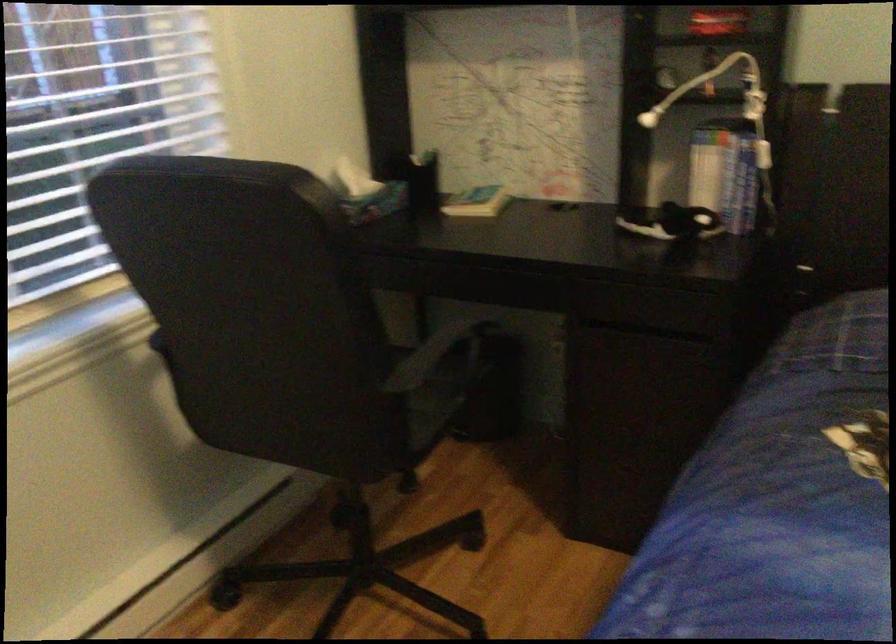
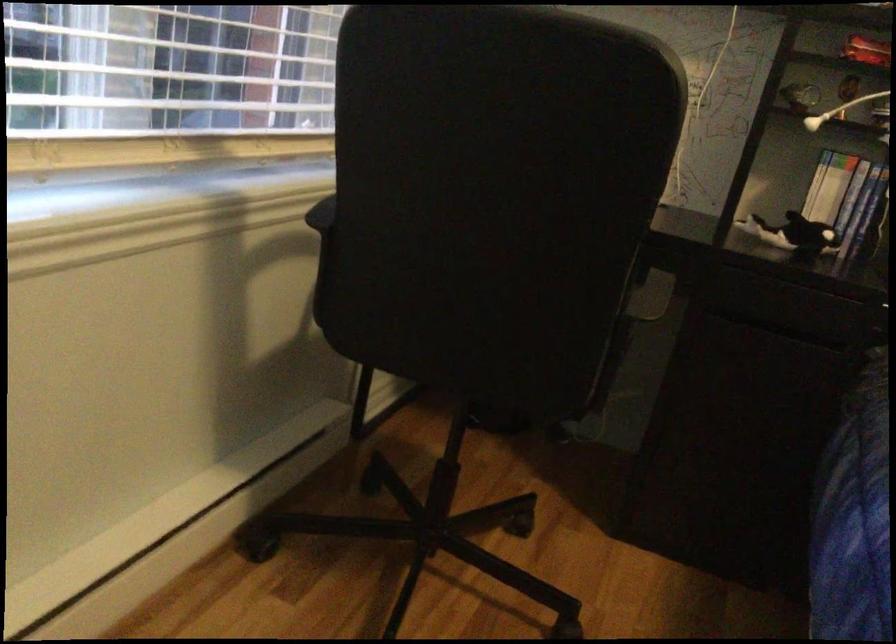
Where in the second image is the point corresponding to pixel 666 526 from the first image?

(853, 518)